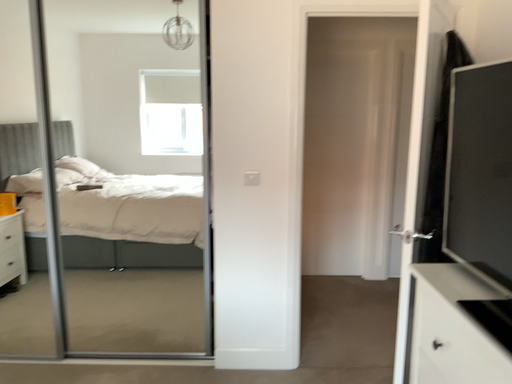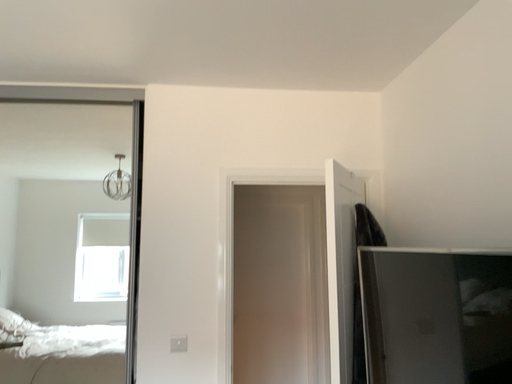
Question: How did the camera likely rotate when shooting the video?

Choices:
 (A) rotated left
 (B) rotated right

Answer: (B)